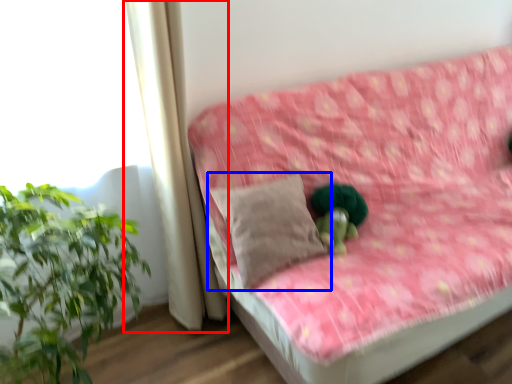
Question: Which object is closer to the camera taking this photo, curtain (highlighted by a red box) or pillow (highlighted by a blue box)?

Choices:
 (A) curtain
 (B) pillow

Answer: (A)